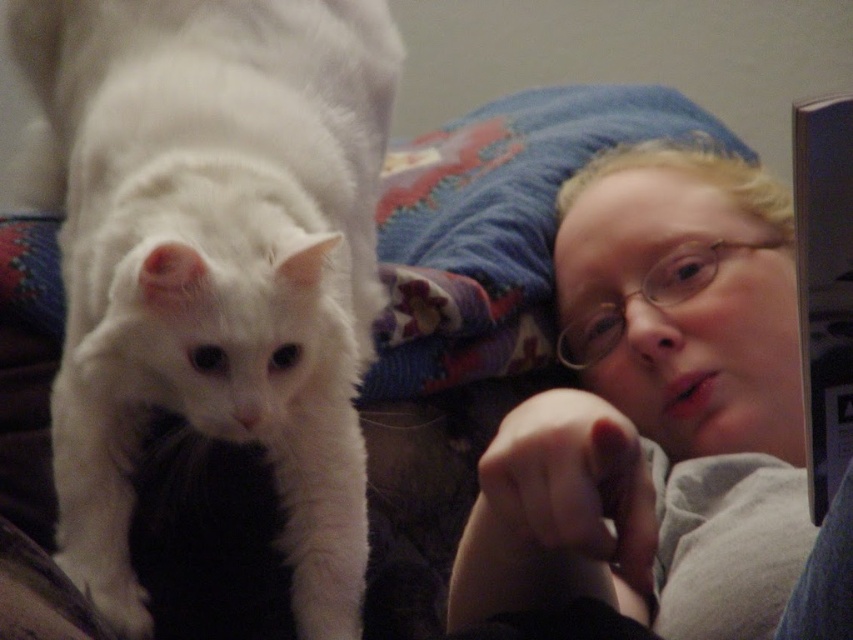
Who is taller, white fluffy cat at left or white fluffy paw at lower left?

Standing taller between the two is white fluffy cat at left.

Which is in front, point (65, 481) or point (607, 524)?

Positioned in front is point (607, 524).

Is point (103, 444) farther from camera compared to point (554, 388)?

No, it is not.

The image size is (853, 640). Find the location of `white fluffy cat at left`. white fluffy cat at left is located at coordinates (215, 262).

Is smooth gray shirt at upper right shorter than white fluffy paw at lower left?

In fact, smooth gray shirt at upper right may be taller than white fluffy paw at lower left.

The height and width of the screenshot is (640, 853). In order to click on smooth gray shirt at upper right in this screenshot , I will do `click(656, 412)`.

Is white fluffy cat at left positioned behind smooth gray shirt at upper right?

That is True.

Does white fluffy cat at left have a smaller size compared to smooth gray shirt at upper right?

Yes, white fluffy cat at left is smaller than smooth gray shirt at upper right.

Is point (292, 253) positioned behind point (775, 308)?

That is False.

You are a GUI agent. You are given a task and a screenshot of the screen. Output one action in this format:
    pyautogui.click(x=<x>, y=<y>)
    Task: Click on the white fluffy cat at left
    
    Given the screenshot: What is the action you would take?
    click(x=215, y=262)